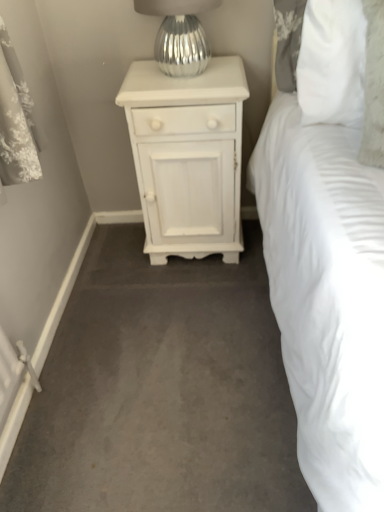
Question: Is white painted wood nightstand at center taller than silver metallic vase at upper center?

Choices:
 (A) no
 (B) yes

Answer: (B)

Question: Is silver metallic vase at upper center completely or partially inside white painted wood nightstand at center?

Choices:
 (A) no
 (B) yes

Answer: (A)

Question: Is white painted wood nightstand at center facing towards silver metallic vase at upper center?

Choices:
 (A) yes
 (B) no

Answer: (B)

Question: Is white painted wood nightstand at center bigger than silver metallic vase at upper center?

Choices:
 (A) no
 (B) yes

Answer: (B)

Question: Does white painted wood nightstand at center have a greater width compared to silver metallic vase at upper center?

Choices:
 (A) no
 (B) yes

Answer: (B)

Question: Considering their positions, is silver metallic vase at upper center located in front of or behind smooth gray carpet at center?

Choices:
 (A) behind
 (B) front

Answer: (A)

Question: Looking at the image, does silver metallic vase at upper center seem bigger or smaller compared to smooth gray carpet at center?

Choices:
 (A) small
 (B) big

Answer: (A)

Question: Considering the positions of point (205, 65) and point (155, 470), is point (205, 65) closer or farther from the camera than point (155, 470)?

Choices:
 (A) farther
 (B) closer

Answer: (A)

Question: Considering the positions of silver metallic vase at upper center and smooth gray carpet at center in the image, is silver metallic vase at upper center taller or shorter than smooth gray carpet at center?

Choices:
 (A) tall
 (B) short

Answer: (A)

Question: Considering the relative positions of smooth gray carpet at center and white painted wood nightstand at center in the image provided, is smooth gray carpet at center to the left or to the right of white painted wood nightstand at center?

Choices:
 (A) right
 (B) left

Answer: (A)

Question: Is point 238,309 positioned closer to the camera than point 170,88?

Choices:
 (A) farther
 (B) closer

Answer: (A)

Question: Is smooth gray carpet at center in front of or behind white painted wood nightstand at center in the image?

Choices:
 (A) front
 (B) behind

Answer: (A)

Question: From a real-world perspective, is smooth gray carpet at center above or below white painted wood nightstand at center?

Choices:
 (A) above
 (B) below

Answer: (B)

Question: Considering their positions, is white painted wood nightstand at center located in front of or behind silver metallic vase at upper center?

Choices:
 (A) front
 (B) behind

Answer: (B)

Question: From a real-world perspective, is white painted wood nightstand at center positioned above or below silver metallic vase at upper center?

Choices:
 (A) below
 (B) above

Answer: (A)